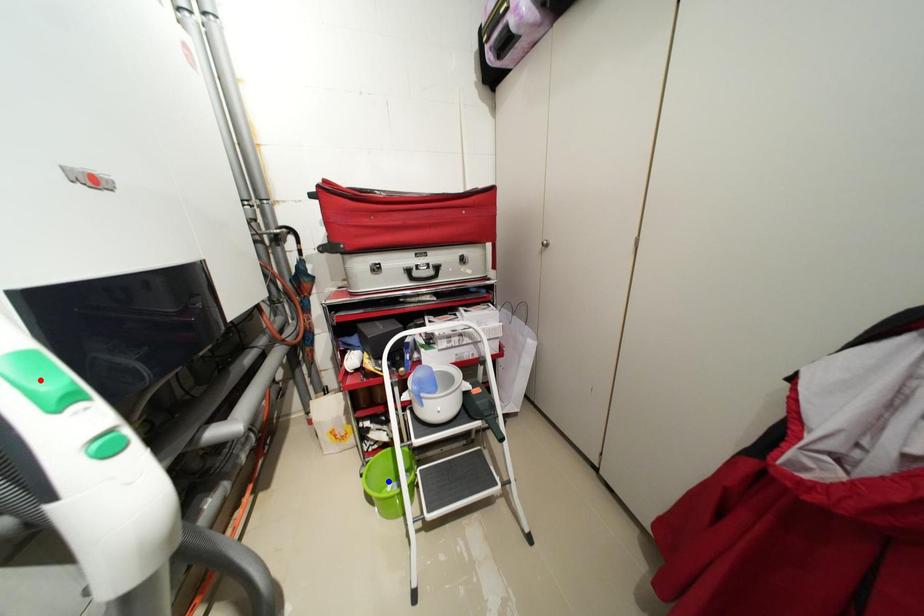
Question: Two points are marked on the image. Which point is closer to the camera?

Choices:
 (A) Blue point is closer.
 (B) Red point is closer.

Answer: (B)